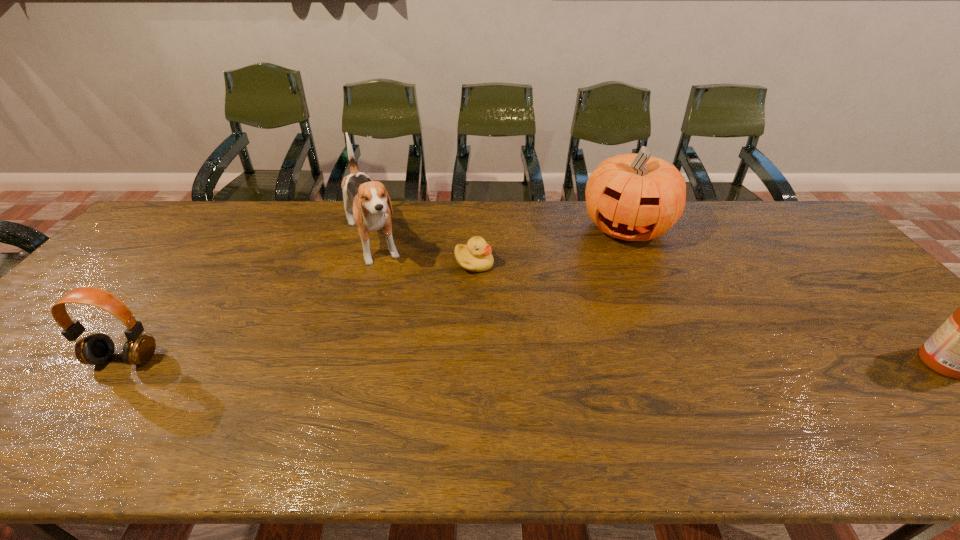
The image size is (960, 540). In the image, there is a desktop. Find the location of `free space at the left edge`. free space at the left edge is located at coordinates (159, 254).

Image resolution: width=960 pixels, height=540 pixels. In the image, there is a desktop. Find the location of `vacant area at the right edge`. vacant area at the right edge is located at coordinates (904, 368).

Image resolution: width=960 pixels, height=540 pixels. What are the coordinates of `vacant region between the duckling and the second object from right to left` in the screenshot? It's located at (550, 245).

Where is `empty space between the second object from left to right and the headset`? empty space between the second object from left to right and the headset is located at coordinates (249, 301).

Find the location of a particular element. This screenshot has width=960, height=540. vacant space that is in between the headset and the fourth object from left to right is located at coordinates (375, 293).

Locate an element on the screen. Image resolution: width=960 pixels, height=540 pixels. empty space that is in between the second object from right to left and the puppy is located at coordinates (499, 235).

You are a GUI agent. You are given a task and a screenshot of the screen. Output one action in this format:
    pyautogui.click(x=<x>, y=<y>)
    Task: Click on the free point between the shortest object and the second shortest object
    The width and height of the screenshot is (960, 540).
    Given the screenshot: What is the action you would take?
    pyautogui.click(x=300, y=311)

Where is `blank region between the fourth tallest object and the second object from left to right`? The height and width of the screenshot is (540, 960). blank region between the fourth tallest object and the second object from left to right is located at coordinates (249, 301).

Where is `vacant space that's between the fourth tallest object and the fourth object from right to left`? The image size is (960, 540). vacant space that's between the fourth tallest object and the fourth object from right to left is located at coordinates (249, 301).

In order to click on free space that is in between the second object from left to right and the headset in this screenshot , I will do `click(249, 301)`.